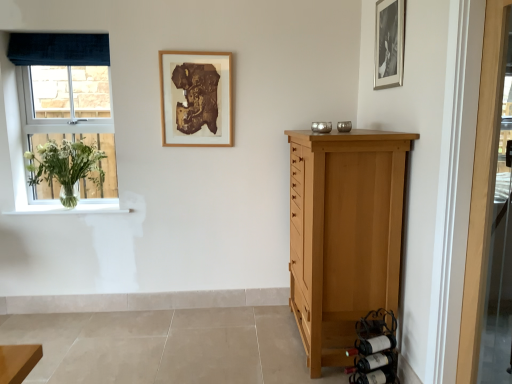
Question: From the image's perspective, relative to dark brown glass wine bottle at lower right, which appears as the 3th wine bottle when viewed from the top, is dark red glass wine bottle at lower right, which is counted as the 2th wine bottle, starting from the top, above or below?

Choices:
 (A) above
 (B) below

Answer: (A)

Question: In terms of height, does dark red glass wine bottle at lower right, which appears as the second wine bottle when ordered from the bottom, look taller or shorter compared to dark brown glass wine bottle at lower right, which appears as the 3th wine bottle when viewed from the top?

Choices:
 (A) tall
 (B) short

Answer: (A)

Question: Based on their relative distances, which object is farther from the dark red glass wine bottle at lower right, which is counted as the 2th wine bottle, starting from the top?

Choices:
 (A) blue velvet window at left
 (B) light brown wood chest of drawers at right
 (C) black matte picture frame at upper right, which appears as the 2th picture frame when viewed from the left
 (D) wooden door at right
 (E) white glossy window sill at left

Answer: (A)

Question: Which object is the farthest from the black matte picture frame at upper right, acting as the 2th picture frame starting from the back?

Choices:
 (A) dark brown glass wine bottle at lower right, marked as the 1th wine bottle in a bottom-to-top arrangement
 (B) dark blue velvet curtain at upper left
 (C) white glossy window sill at left
 (D) wooden door at right
 (E) light brown wood chest of drawers at right

Answer: (C)